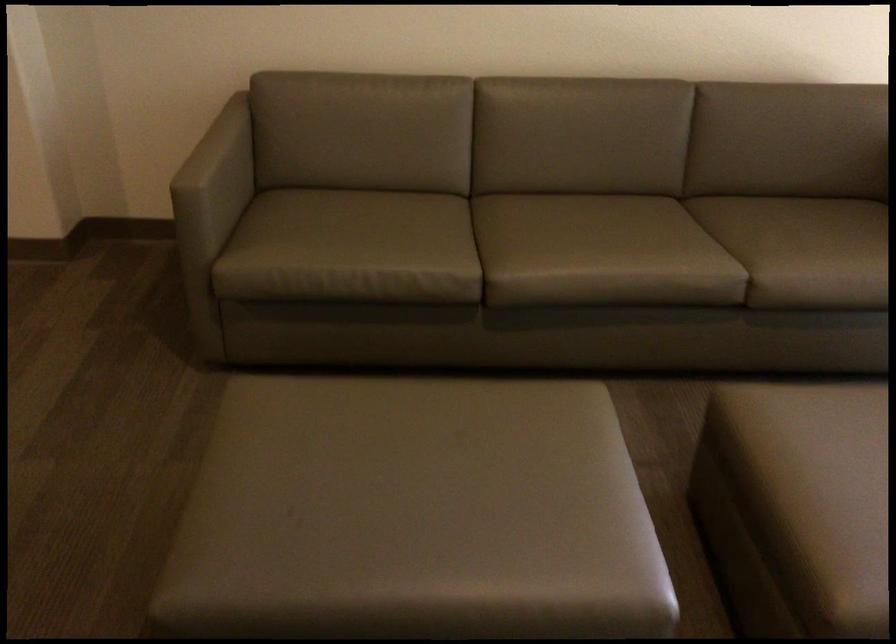
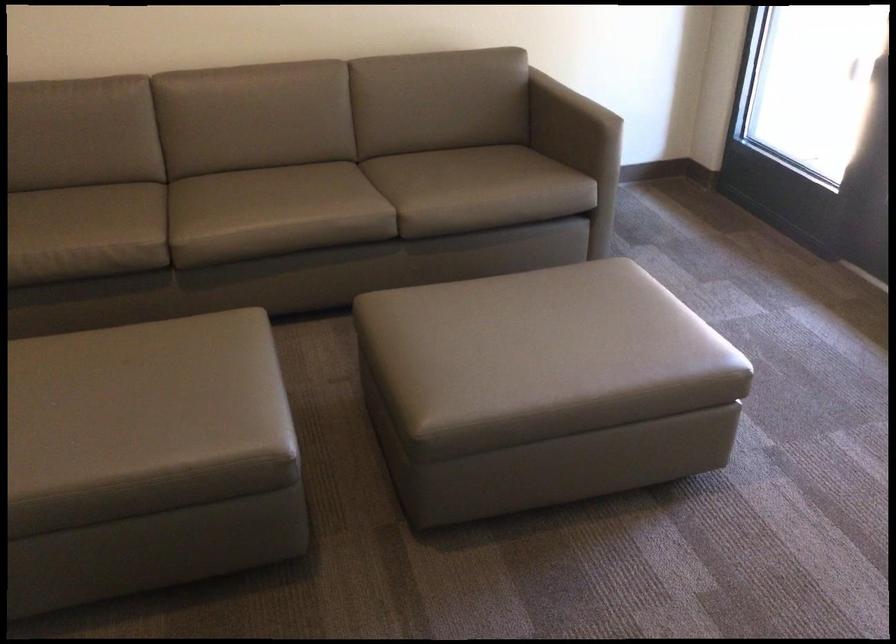
Question: Based on the continuous images, in which direction is the camera rotating? Reply with the corresponding letter.

Choices:
 (A) Left
 (B) Right
 (C) Up
 (D) Down

Answer: (B)